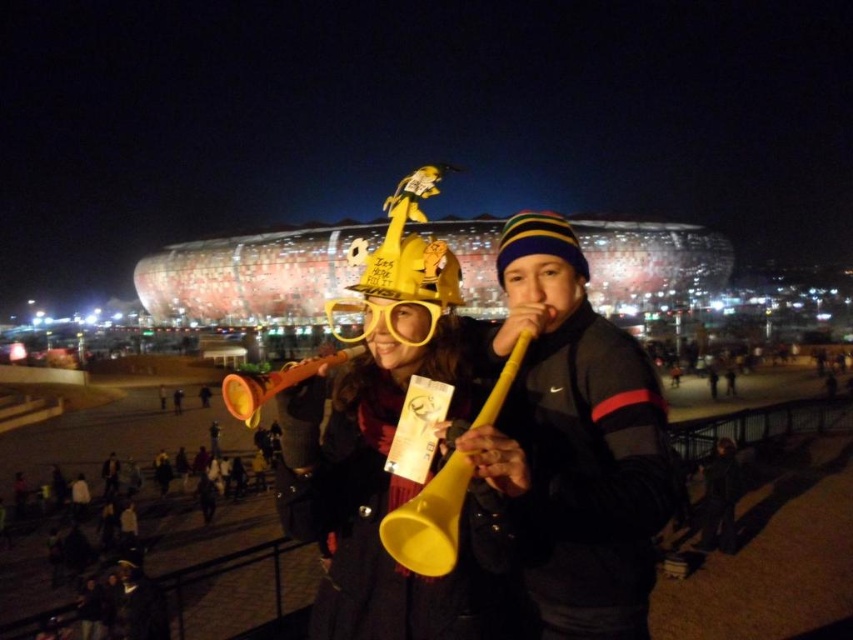
Where is `yellow plastic trumpet at center`? This screenshot has height=640, width=853. yellow plastic trumpet at center is located at coordinates (428, 522).

Can you confirm if yellow plastic trumpet at center is shorter than dark gray fabric jacket at lower right?

In fact, yellow plastic trumpet at center may be taller than dark gray fabric jacket at lower right.

Image resolution: width=853 pixels, height=640 pixels. What are the coordinates of `yellow plastic trumpet at center` in the screenshot? It's located at (428, 522).

From the picture: Which is more to the right, matte orange trumpet at center or dark gray fabric jacket at lower right?

Positioned to the right is dark gray fabric jacket at lower right.

Does matte orange trumpet at center have a smaller size compared to dark gray fabric jacket at lower right?

No.

Describe the element at coordinates (273, 384) in the screenshot. I see `matte orange trumpet at center` at that location.

At what (x,y) coordinates should I click in order to perform the action: click on matte orange trumpet at center. Please return your answer as a coordinate pair (x, y). Image resolution: width=853 pixels, height=640 pixels. Looking at the image, I should click on (273, 384).

Can you confirm if yellow matte horn at center is bigger than dark gray fabric jacket at lower right?

Yes, yellow matte horn at center is bigger than dark gray fabric jacket at lower right.

Can you confirm if yellow matte horn at center is smaller than dark gray fabric jacket at lower right?

No.

Where is `yellow matte horn at center`? yellow matte horn at center is located at coordinates (576, 442).

Locate an element on the screen. yellow matte horn at center is located at coordinates (576, 442).